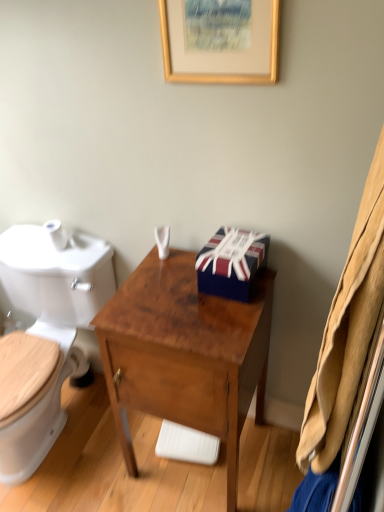
Question: Could you tell me if brown wood desk at center is facing union jack-patterned gift box at center?

Choices:
 (A) no
 (B) yes

Answer: (A)

Question: Can union jack-patterned gift box at center be found inside brown wood desk at center?

Choices:
 (A) yes
 (B) no

Answer: (B)

Question: From the image's perspective, is brown wood desk at center below union jack-patterned gift box at center?

Choices:
 (A) no
 (B) yes

Answer: (B)

Question: Is brown wood desk at center taller than union jack-patterned gift box at center?

Choices:
 (A) yes
 (B) no

Answer: (A)

Question: Is brown wood desk at center at the right side of union jack-patterned gift box at center?

Choices:
 (A) no
 (B) yes

Answer: (A)

Question: Is brown wood desk at center shorter than union jack-patterned gift box at center?

Choices:
 (A) yes
 (B) no

Answer: (B)

Question: Can you confirm if white glossy toilet at left is bigger than gold wooden picture frame at upper center?

Choices:
 (A) yes
 (B) no

Answer: (A)

Question: Is white glossy toilet at left positioned in front of gold wooden picture frame at upper center?

Choices:
 (A) no
 (B) yes

Answer: (A)

Question: Is white glossy toilet at left at the right side of gold wooden picture frame at upper center?

Choices:
 (A) yes
 (B) no

Answer: (B)

Question: From the image's perspective, is white glossy toilet at left above gold wooden picture frame at upper center?

Choices:
 (A) no
 (B) yes

Answer: (A)

Question: From the image's perspective, is white glossy toilet at left located beneath gold wooden picture frame at upper center?

Choices:
 (A) no
 (B) yes

Answer: (B)

Question: Does white glossy toilet at left have a lesser width compared to gold wooden picture frame at upper center?

Choices:
 (A) yes
 (B) no

Answer: (B)

Question: Can we say white glossy toilet at left lies outside white matte toilet paper at left?

Choices:
 (A) yes
 (B) no

Answer: (A)